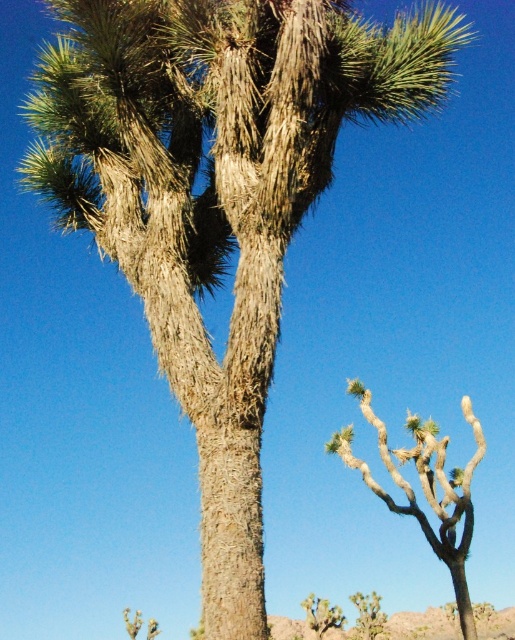
Is green spiky plant at lower center wider than green spiky cactus at lower right?

Correct, the width of green spiky plant at lower center exceeds that of green spiky cactus at lower right.

Is point (322, 602) closer to viewer compared to point (375, 621)?

Yes, point (322, 602) is closer to viewer.

Locate an element on the screen. The width and height of the screenshot is (515, 640). green spiky plant at lower center is located at coordinates (320, 616).

The width and height of the screenshot is (515, 640). I want to click on green spiky plant at lower center, so click(x=320, y=616).

Does brown textured joshua tree at lower right have a greater width compared to green spiky plant at lower center?

Yes.

Is point (406, 493) closer to viewer compared to point (321, 627)?

Yes, point (406, 493) is closer to viewer.

The width and height of the screenshot is (515, 640). What do you see at coordinates (425, 488) in the screenshot?
I see `brown textured joshua tree at lower right` at bounding box center [425, 488].

At what (x,y) coordinates should I click in order to perform the action: click on brown textured joshua tree at lower right. Please return your answer as a coordinate pair (x, y). The height and width of the screenshot is (640, 515). Looking at the image, I should click on (425, 488).

How much distance is there between brown textured joshua tree at lower right and green spiky cactus at lower right?

brown textured joshua tree at lower right is 41.51 feet from green spiky cactus at lower right.

Who is higher up, brown textured joshua tree at lower right or green spiky cactus at lower right?

brown textured joshua tree at lower right

Where is `brown textured joshua tree at lower right`? Image resolution: width=515 pixels, height=640 pixels. brown textured joshua tree at lower right is located at coordinates (425, 488).